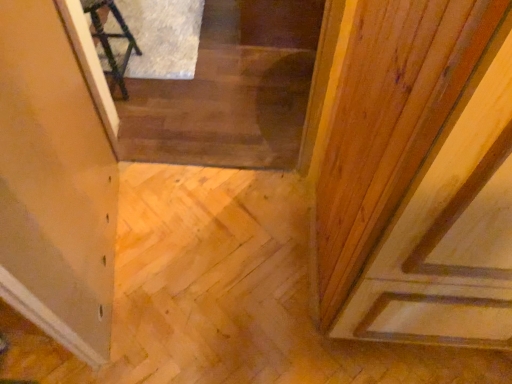
Image resolution: width=512 pixels, height=384 pixels. Find the location of `vacant space to the right of dark wood chair at upper left`. vacant space to the right of dark wood chair at upper left is located at coordinates (167, 89).